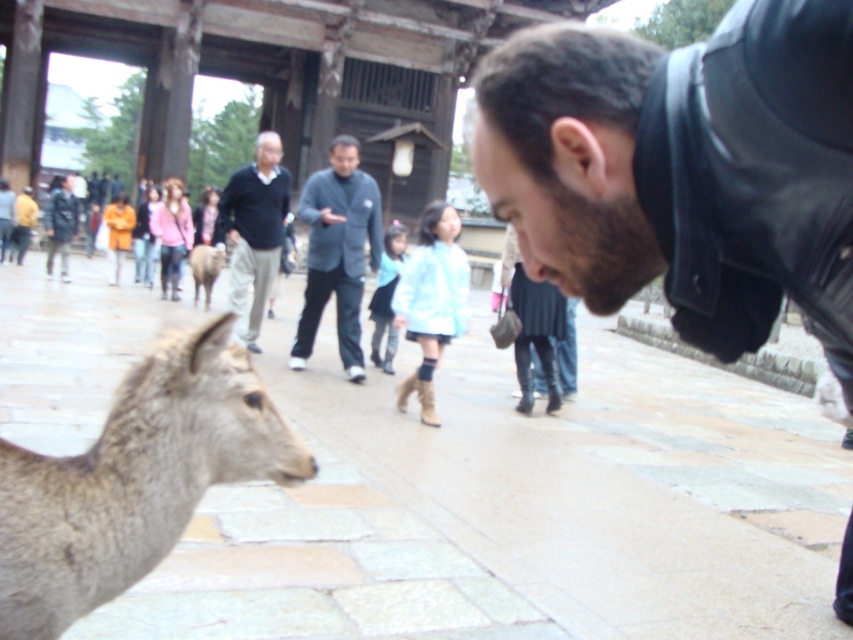
Question: Which object is farther from the camera taking this photo?

Choices:
 (A) dark blue sweater at center
 (B) dark gray suit at center

Answer: (A)

Question: Estimate the real-world distances between objects in this image. Which object is closer to the dark blue sweater at center?

Choices:
 (A) dark gray suit at center
 (B) gray fur deer at lower left
 (C) black leather jacket at lower right

Answer: (A)

Question: In this image, where is gray fur deer at lower left located relative to dark blue sweater at center?

Choices:
 (A) left
 (B) right

Answer: (B)

Question: Is black leather jacket at lower right positioned in front of dark gray suit at center?

Choices:
 (A) no
 (B) yes

Answer: (B)

Question: Is black leather jacket at lower right in front of gray fur deer at lower left?

Choices:
 (A) yes
 (B) no

Answer: (A)

Question: Which point appears closest to the camera in this image?

Choices:
 (A) (270, 280)
 (B) (271, 438)

Answer: (B)